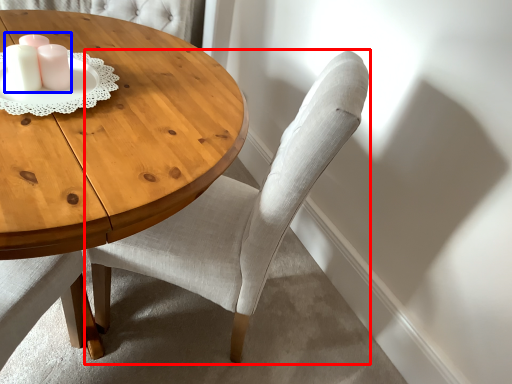
Question: Which of the following is the farthest to the observer, chair (highlighted by a red box) or candle holder (highlighted by a blue box)?

Choices:
 (A) chair
 (B) candle holder

Answer: (B)